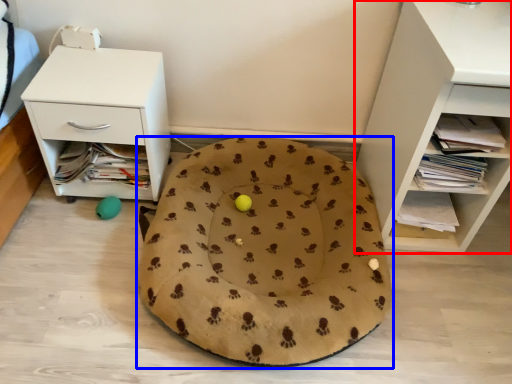
Question: Which object appears closest to the camera in this image, shelf (highlighted by a red box) or dog bed (highlighted by a blue box)?

Choices:
 (A) shelf
 (B) dog bed

Answer: (A)